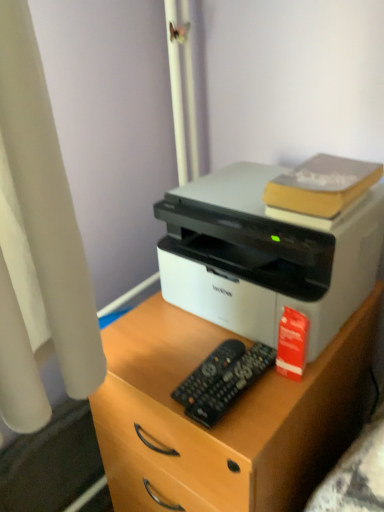
Question: Should I look upward or downward to see yellow matte book at upper right, the 2th book ordered from the bottom?

Choices:
 (A) up
 (B) down

Answer: (A)

Question: Is white matte printer at center placed right next to yellow matte book at upper right, arranged as the 1th book when viewed from the top?

Choices:
 (A) no
 (B) yes

Answer: (A)

Question: Is white matte printer at center in front of yellow matte book at upper right, arranged as the 1th book when viewed from the top?

Choices:
 (A) no
 (B) yes

Answer: (B)

Question: Can you confirm if white matte printer at center is positioned to the right of yellow matte book at upper right, the 2th book ordered from the bottom?

Choices:
 (A) no
 (B) yes

Answer: (A)

Question: From a real-world perspective, does white matte printer at center stand above yellow matte book at upper right, arranged as the 1th book when viewed from the top?

Choices:
 (A) yes
 (B) no

Answer: (B)

Question: From the image's perspective, is white matte printer at center located above yellow matte book at upper right, arranged as the 1th book when viewed from the top?

Choices:
 (A) no
 (B) yes

Answer: (A)

Question: Can you confirm if white matte printer at center is thinner than yellow matte book at upper right, arranged as the 1th book when viewed from the top?

Choices:
 (A) no
 (B) yes

Answer: (A)

Question: Considering the relative sizes of white matte printer at center and red matte book at right, the 1th book ordered from the bottom, in the image provided, is white matte printer at center taller than red matte book at right, the 1th book ordered from the bottom,?

Choices:
 (A) yes
 (B) no

Answer: (A)

Question: Does white matte printer at center have a lesser height compared to red matte book at right, the 1th book ordered from the bottom?

Choices:
 (A) yes
 (B) no

Answer: (B)

Question: Would you consider white matte printer at center to be distant from red matte book at right, the 1th book ordered from the bottom?

Choices:
 (A) yes
 (B) no

Answer: (B)

Question: Is white matte printer at center looking in the opposite direction of red matte book at right, marked as the second book in a top-to-bottom arrangement?

Choices:
 (A) yes
 (B) no

Answer: (B)

Question: Is white matte printer at center at the right side of red matte book at right, marked as the second book in a top-to-bottom arrangement?

Choices:
 (A) yes
 (B) no

Answer: (B)

Question: From a real-world perspective, does white matte printer at center stand above red matte book at right, marked as the second book in a top-to-bottom arrangement?

Choices:
 (A) no
 (B) yes

Answer: (A)

Question: Can you confirm if black plastic remote at center, the 1th control positioned from the front, is smaller than red matte book at right, marked as the second book in a top-to-bottom arrangement?

Choices:
 (A) no
 (B) yes

Answer: (B)